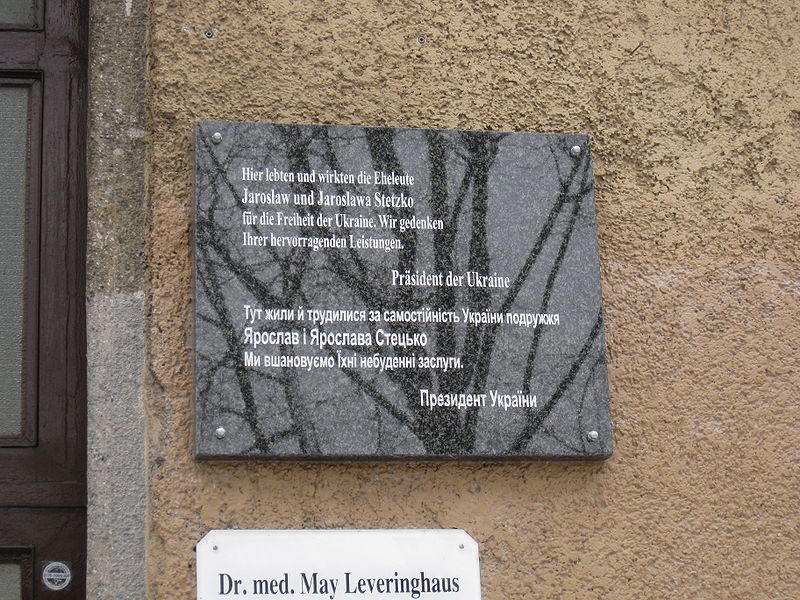
Identify the location of frosted glass. (17, 253), (8, 575).